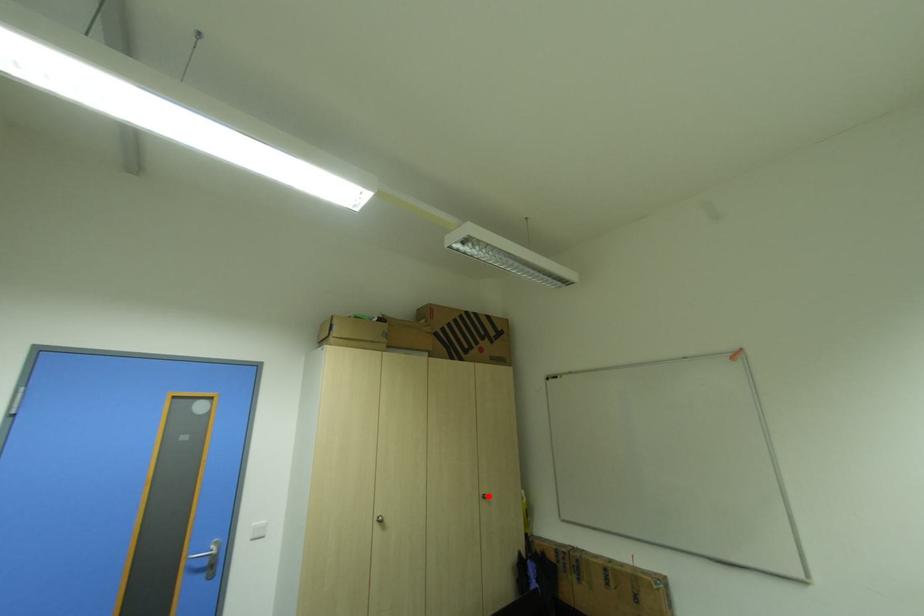
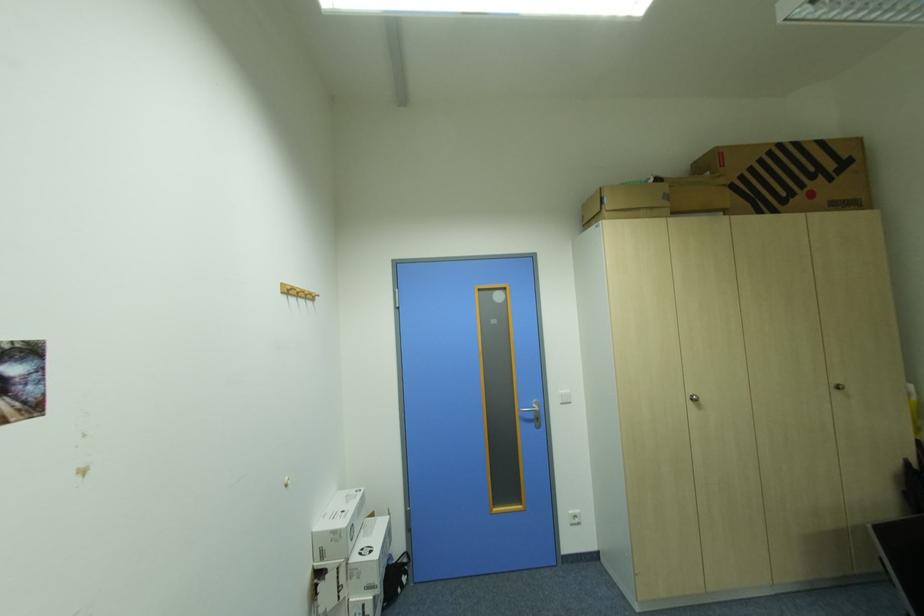
Locate, in the second image, the point that corresponds to the highlighted location in the first image.

(840, 386)